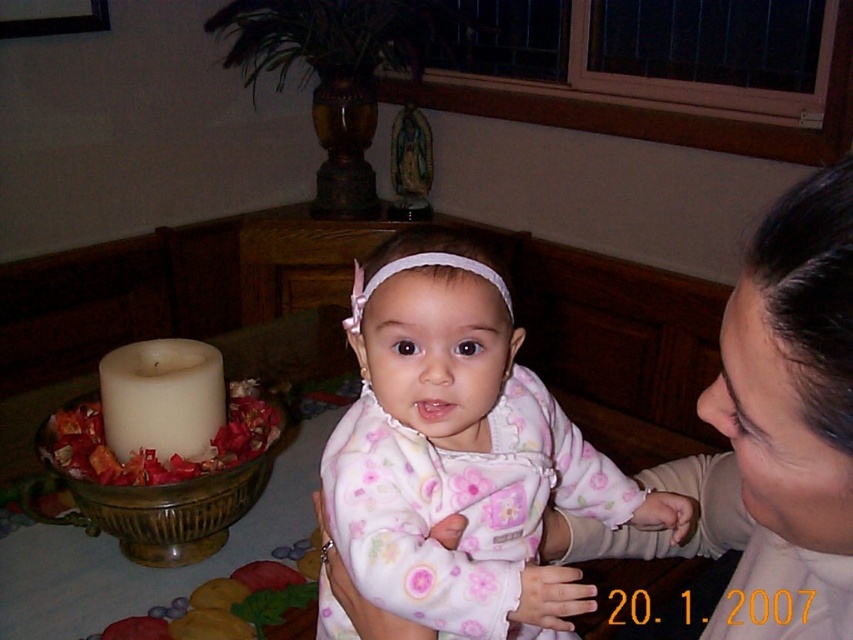
Can you confirm if fluffy pink pajamas at center is smaller than smooth beige sweater at upper right?

No, fluffy pink pajamas at center is not smaller than smooth beige sweater at upper right.

Does fluffy pink pajamas at center lie in front of smooth beige sweater at upper right?

No, fluffy pink pajamas at center is further to the viewer.

Is point (335, 500) farther from viewer compared to point (722, 385)?

That is True.

Where is `fluffy pink pajamas at center`? This screenshot has width=853, height=640. fluffy pink pajamas at center is located at coordinates (473, 454).